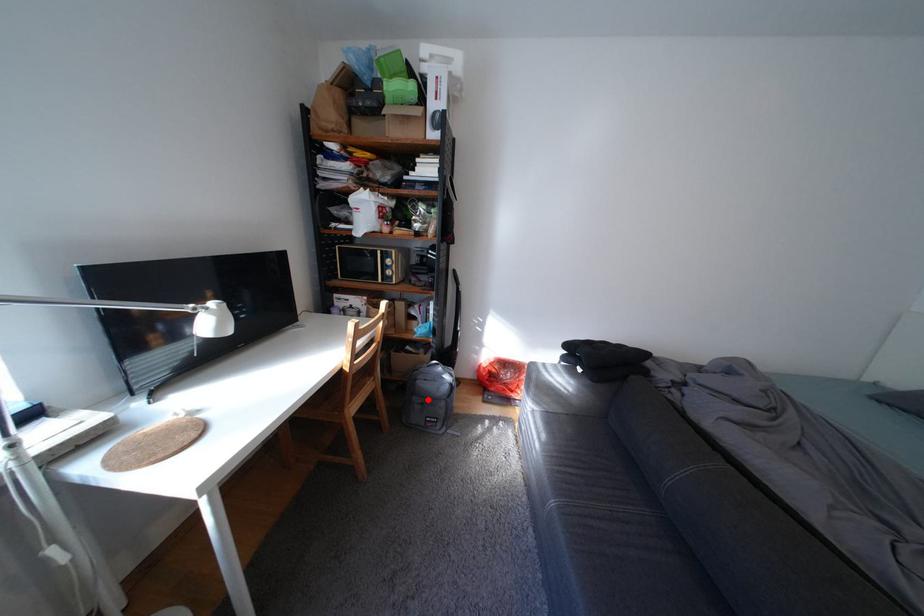
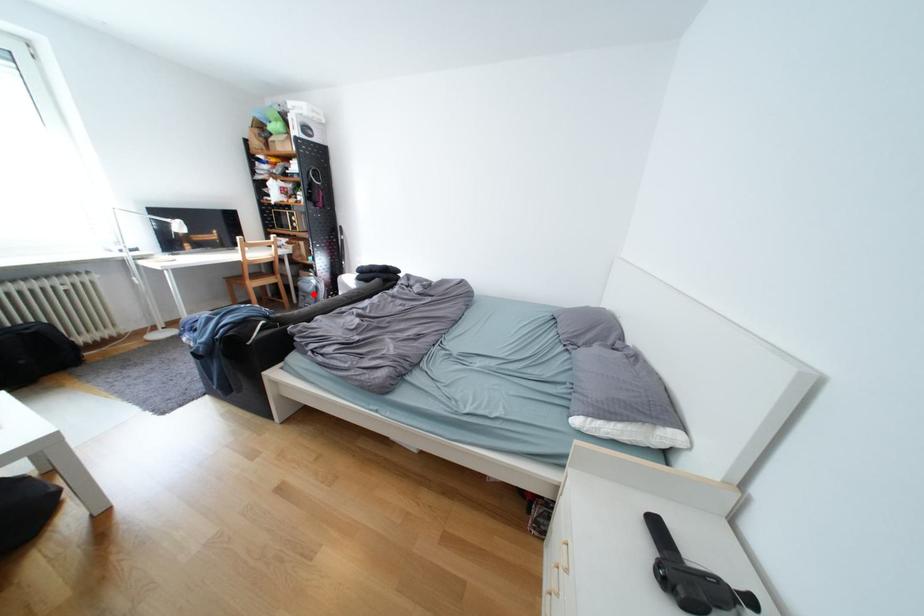
I am providing you with two images of the same scene from different viewpoints. A red point is marked on the first image and another point is marked on the second image. Does the point marked in image1 correspond to the same location as the one in image2?

Yes